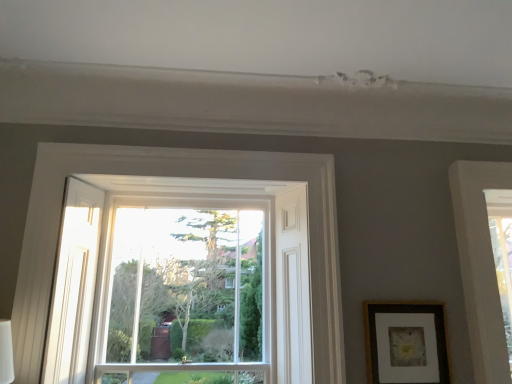
Question: Is matte brown picture frame at right oriented away from clear glass window at center?

Choices:
 (A) no
 (B) yes

Answer: (A)

Question: Is matte brown picture frame at right at the left side of clear glass window at center?

Choices:
 (A) no
 (B) yes

Answer: (A)

Question: Is matte brown picture frame at right to the right of clear glass window at center from the viewer's perspective?

Choices:
 (A) no
 (B) yes

Answer: (B)

Question: Is matte brown picture frame at right bigger than clear glass window at center?

Choices:
 (A) yes
 (B) no

Answer: (B)

Question: Can you confirm if matte brown picture frame at right is wider than clear glass window at center?

Choices:
 (A) yes
 (B) no

Answer: (B)

Question: Can you confirm if matte brown picture frame at right is smaller than clear glass window at center?

Choices:
 (A) yes
 (B) no

Answer: (A)

Question: Could matte brown picture frame at right be considered to be inside clear glass window at center?

Choices:
 (A) yes
 (B) no

Answer: (B)

Question: Considering the relative sizes of clear glass window at center and matte brown picture frame at right in the image provided, is clear glass window at center smaller than matte brown picture frame at right?

Choices:
 (A) yes
 (B) no

Answer: (B)

Question: Is clear glass window at center closer to camera compared to matte brown picture frame at right?

Choices:
 (A) yes
 (B) no

Answer: (B)

Question: Can we say clear glass window at center lies outside matte brown picture frame at right?

Choices:
 (A) yes
 (B) no

Answer: (A)

Question: Does clear glass window at center have a lesser height compared to matte brown picture frame at right?

Choices:
 (A) no
 (B) yes

Answer: (A)

Question: Considering the relative sizes of clear glass window at center and matte brown picture frame at right in the image provided, is clear glass window at center wider than matte brown picture frame at right?

Choices:
 (A) yes
 (B) no

Answer: (A)

Question: Visually, is clear glass window at center positioned to the left or to the right of matte brown picture frame at right?

Choices:
 (A) left
 (B) right

Answer: (A)